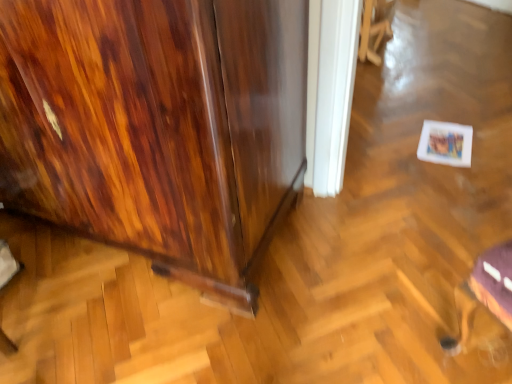
Locate an element on the screen. Image resolution: width=512 pixels, height=384 pixels. free space between metallic silver swivel chair at lower right, which is the first swivel chair in bottom-to-top order, and wooden cabinet at left is located at coordinates (349, 290).